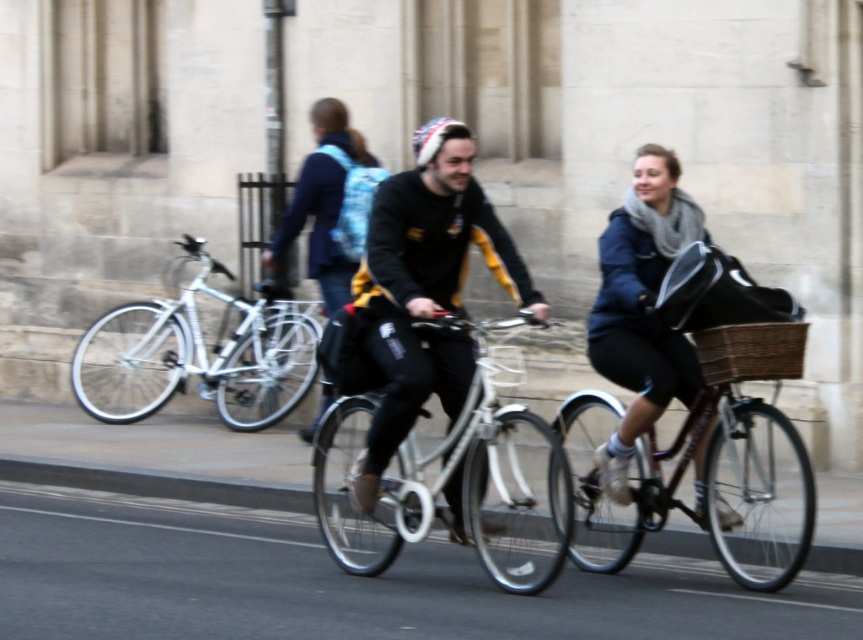
Question: Which point is closer to the camera taking this photo?

Choices:
 (A) (111, 321)
 (B) (605, 452)
 (C) (433, 120)

Answer: (B)

Question: Which object is positioned closest to the blue plaid backpack at center?

Choices:
 (A) matte black bicycle at center
 (B) brown wicker basket at center

Answer: (A)

Question: Can you confirm if black matte jacket at center is positioned to the right of blue plaid backpack at center?

Choices:
 (A) no
 (B) yes

Answer: (B)

Question: Considering the relative positions of matte black bicycle at center and white fabric helmet at center in the image provided, where is matte black bicycle at center located with respect to white fabric helmet at center?

Choices:
 (A) below
 (B) above

Answer: (A)

Question: Is black matte jacket at center below white fabric helmet at center?

Choices:
 (A) yes
 (B) no

Answer: (A)

Question: Considering the real-world distances, which object is farthest from the blue plaid backpack at center?

Choices:
 (A) white fabric helmet at center
 (B) black matte jacket at center
 (C) blue fleece jacket at center

Answer: (A)